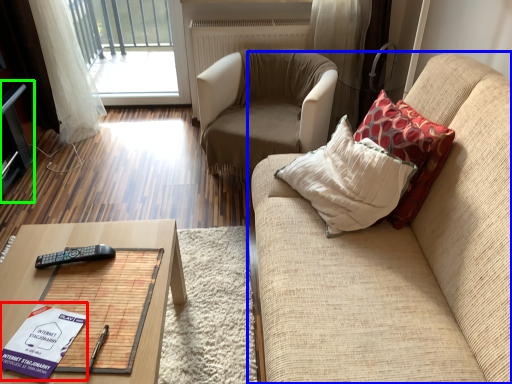
Question: Which object is the farthest from book (highlighted by a red box)? Choose among these: studio couch (highlighted by a blue box) or entertainment center (highlighted by a green box).

Choices:
 (A) studio couch
 (B) entertainment center

Answer: (B)